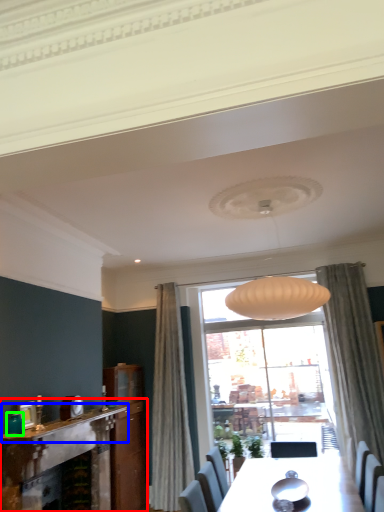
Question: Which is farther away from fireplace (highlighted by a red box)? mantle (highlighted by a blue box) or teal (highlighted by a green box)?

Choices:
 (A) mantle
 (B) teal

Answer: (B)